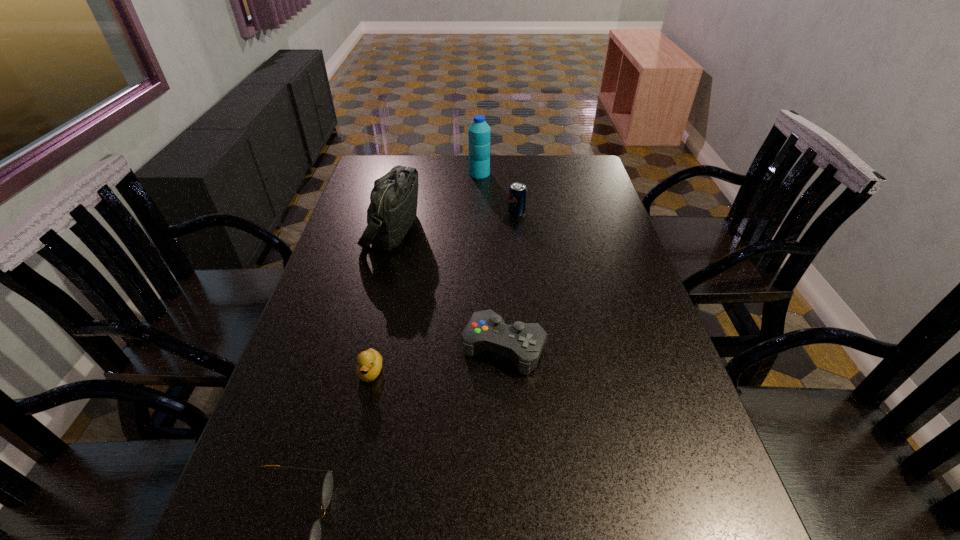
Locate an element on the screen. water bottle is located at coordinates (479, 131).

Where is `shoulder bag`? shoulder bag is located at coordinates pyautogui.click(x=393, y=200).

Locate an element on the screen. Image resolution: width=960 pixels, height=540 pixels. soda can is located at coordinates (517, 193).

In order to click on control in this screenshot , I will do `click(523, 343)`.

I want to click on duckling, so click(369, 363).

Where is `vacant point located 0.050m on the left of the water bottle`? This screenshot has width=960, height=540. vacant point located 0.050m on the left of the water bottle is located at coordinates (456, 173).

You are a GUI agent. You are given a task and a screenshot of the screen. Output one action in this format:
    pyautogui.click(x=<x>, y=<y>)
    Task: Click on the free point located at the front padded panel of the shoulder bag
    The width and height of the screenshot is (960, 540).
    Given the screenshot: What is the action you would take?
    pyautogui.click(x=447, y=229)

Find the location of `free location located on the left of the soda can`. free location located on the left of the soda can is located at coordinates (409, 213).

I want to click on free space located 0.070m on the front of the control, so click(x=507, y=404).

The width and height of the screenshot is (960, 540). In order to click on vacant space located facing forward on the duckling in this screenshot , I will do `click(363, 408)`.